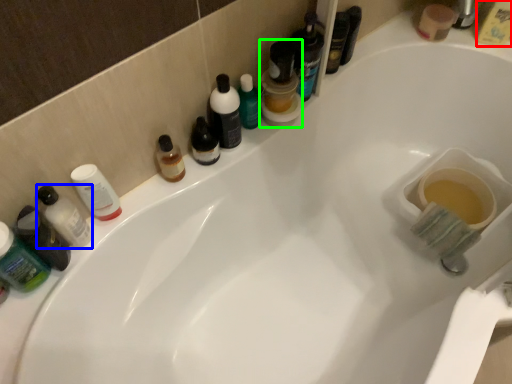
Question: Which is farther away from mouthwash (highlighted by a red box)? toiletry (highlighted by a blue box) or mouthwash (highlighted by a green box)?

Choices:
 (A) toiletry
 (B) mouthwash

Answer: (A)